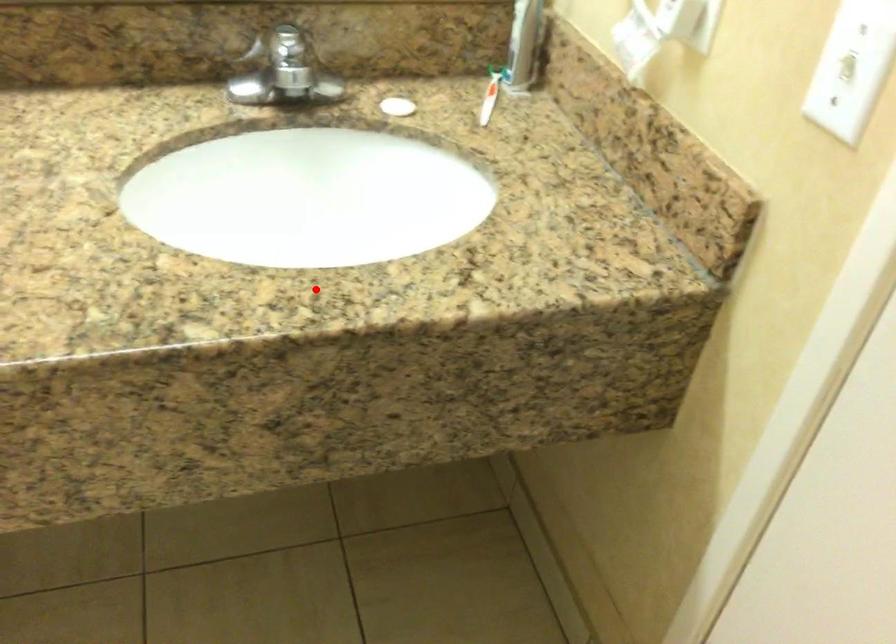
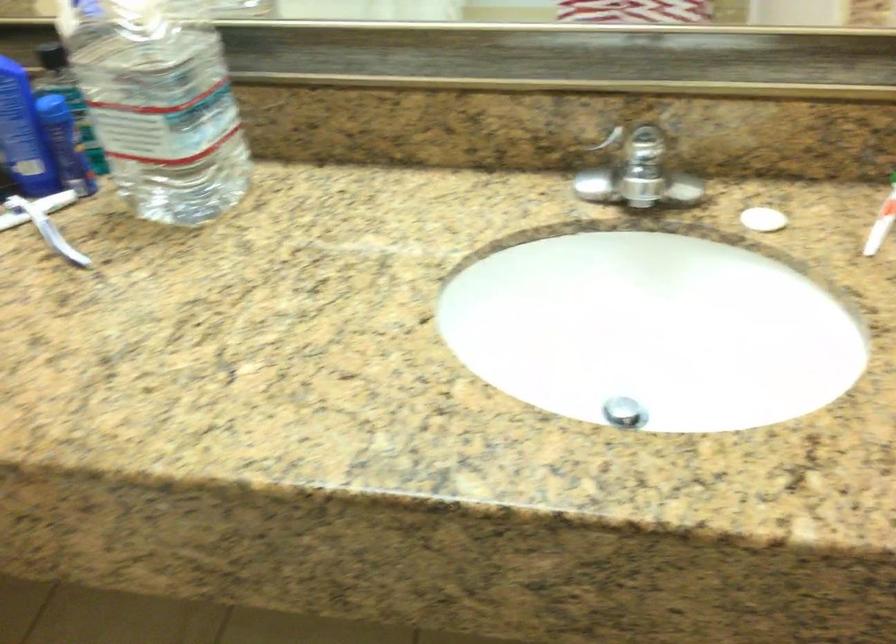
Question: I am providing you with two images of the same scene from different viewpoints. In image1, a red point is highlighted. Considering the same 3D point in image2, which of the following is correct?

Choices:
 (A) It is closer
 (B) It is farther

Answer: (B)